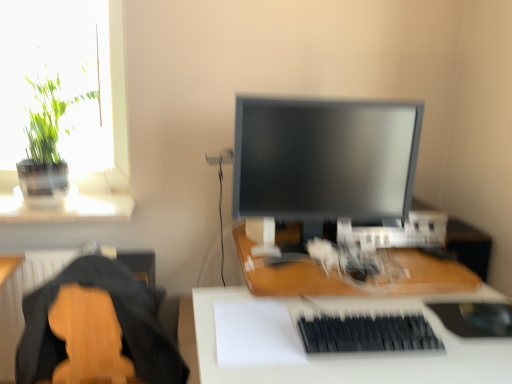
Question: From a real-world perspective, is wooden desk at center, arranged as the 1th desk when viewed from the top, located higher than white matte desk at center, which is counted as the first desk, starting from the bottom?

Choices:
 (A) yes
 (B) no

Answer: (A)

Question: Does wooden desk at center, which appears as the second desk when ordered from the bottom, touch white matte desk at center, which is counted as the first desk, starting from the bottom?

Choices:
 (A) no
 (B) yes

Answer: (A)

Question: Would you consider wooden desk at center, which appears as the second desk when ordered from the bottom, to be distant from white matte desk at center, positioned as the second desk in top-to-bottom order?

Choices:
 (A) yes
 (B) no

Answer: (B)

Question: Is white matte desk at center, which is counted as the first desk, starting from the bottom, completely or partially inside wooden desk at center, arranged as the 1th desk when viewed from the top?

Choices:
 (A) no
 (B) yes

Answer: (A)

Question: Is wooden desk at center, which appears as the second desk when ordered from the bottom, positioned behind white matte desk at center, positioned as the second desk in top-to-bottom order?

Choices:
 (A) yes
 (B) no

Answer: (A)

Question: In terms of size, does wooden desk at center, arranged as the 1th desk when viewed from the top, appear bigger or smaller than black matte keyboard at lower center?

Choices:
 (A) big
 (B) small

Answer: (A)

Question: Is wooden desk at center, which appears as the second desk when ordered from the bottom, taller or shorter than black matte keyboard at lower center?

Choices:
 (A) tall
 (B) short

Answer: (B)

Question: Is wooden desk at center, arranged as the 1th desk when viewed from the top, to the left or to the right of black matte keyboard at lower center in the image?

Choices:
 (A) left
 (B) right

Answer: (A)

Question: From the image's perspective, relative to black matte keyboard at lower center, is wooden desk at center, which appears as the second desk when ordered from the bottom, above or below?

Choices:
 (A) above
 (B) below

Answer: (A)

Question: From a real-world perspective, is black rubber mousepad at lower right physically located above or below wooden desk at center, which appears as the second desk when ordered from the bottom?

Choices:
 (A) above
 (B) below

Answer: (B)

Question: Looking at their shapes, would you say black rubber mousepad at lower right is wider or thinner than wooden desk at center, which appears as the second desk when ordered from the bottom?

Choices:
 (A) thin
 (B) wide

Answer: (A)

Question: Based on their sizes in the image, would you say black rubber mousepad at lower right is bigger or smaller than wooden desk at center, arranged as the 1th desk when viewed from the top?

Choices:
 (A) big
 (B) small

Answer: (B)

Question: Does point (502, 324) appear closer or farther from the camera than point (265, 268)?

Choices:
 (A) closer
 (B) farther

Answer: (A)

Question: Would you say matte black monitor at center is inside or outside wooden desk at center, which appears as the second desk when ordered from the bottom?

Choices:
 (A) outside
 (B) inside

Answer: (A)

Question: In terms of width, does matte black monitor at center look wider or thinner when compared to wooden desk at center, arranged as the 1th desk when viewed from the top?

Choices:
 (A) thin
 (B) wide

Answer: (A)